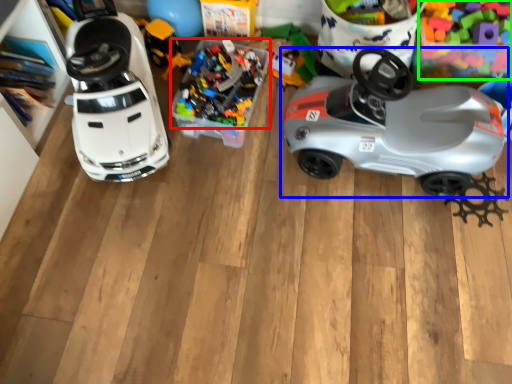
Question: Estimate the real-world distances between objects in this image. Which object is farther from toy (highlighted by a red box), car (highlighted by a blue box) or toy (highlighted by a green box)?

Choices:
 (A) car
 (B) toy

Answer: (B)